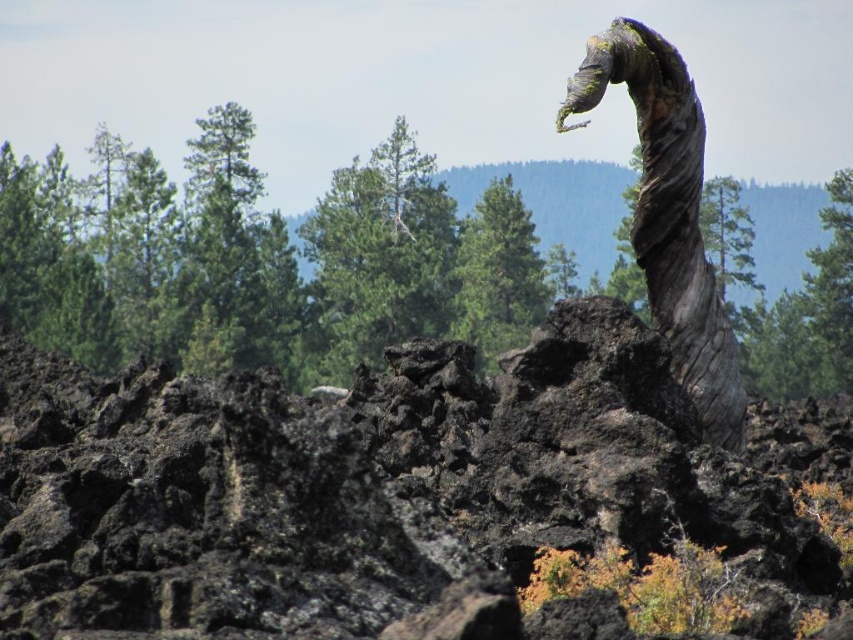
Image resolution: width=853 pixels, height=640 pixels. What do you see at coordinates (416, 500) in the screenshot?
I see `black volcanic rock at center` at bounding box center [416, 500].

Between black volcanic rock at center and gray rough bark tree trunk at right, which one is positioned higher?

Positioned higher is gray rough bark tree trunk at right.

Does point (292, 442) come farther from viewer compared to point (729, 404)?

That is False.

I want to click on black volcanic rock at center, so click(416, 500).